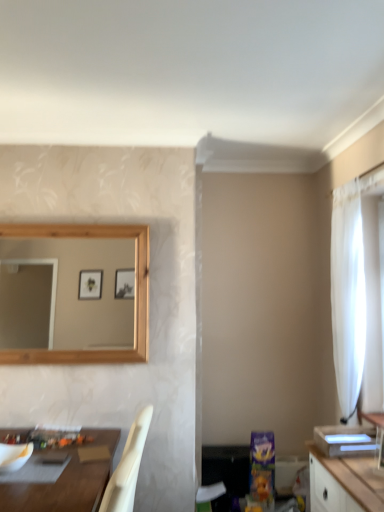
I want to click on free spot in front of white matte mixing bowl at lower left, so click(x=14, y=487).